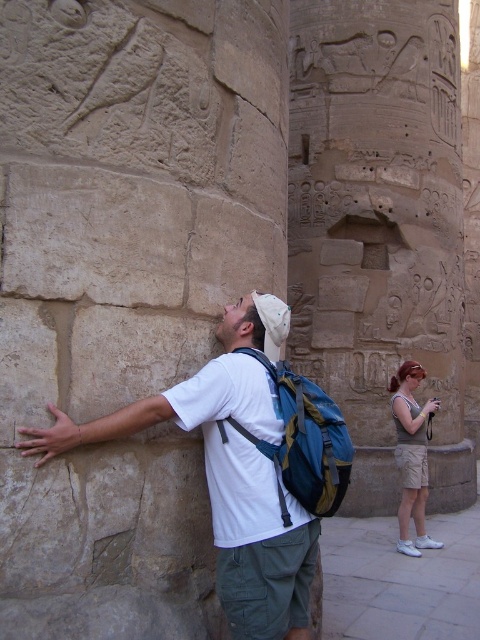
Who is higher up, carved stone column at center or light brown cotton shorts at lower right?

Positioned higher is carved stone column at center.

Who is more forward, [382,317] or [411,449]?

Point [411,449] is in front.

The width and height of the screenshot is (480, 640). Identify the location of carved stone column at center. (379, 227).

Does point (232, 556) come behind point (399, 410)?

That is False.

Which is behind, point (216, 534) or point (408, 380)?

The point (408, 380) is more distant.

Where is `matte white t-shirt at center`? The image size is (480, 640). matte white t-shirt at center is located at coordinates (228, 474).

Which of these two, carved stone column at center or matte white t-shirt at center, stands shorter?

Standing shorter between the two is matte white t-shirt at center.

Does carved stone column at center have a smaller size compared to matte white t-shirt at center?

Actually, carved stone column at center might be larger than matte white t-shirt at center.

Does point (444, 48) lie in front of point (168, 417)?

No, it is not.

The image size is (480, 640). What are the coordinates of `carved stone column at center` in the screenshot? It's located at (379, 227).